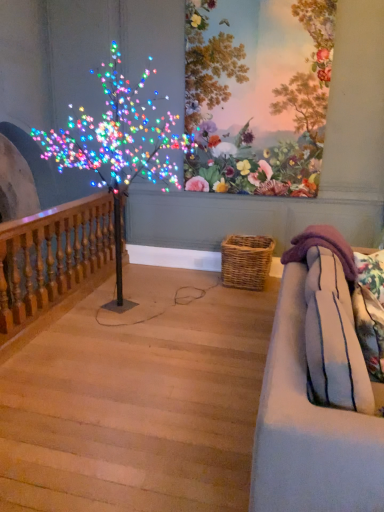
Question: Looking at their shapes, would you say floral wallpaper at upper center is wider or thinner than wooden baluster at left?

Choices:
 (A) thin
 (B) wide

Answer: (A)

Question: In terms of size, does floral wallpaper at upper center appear bigger or smaller than wooden baluster at left?

Choices:
 (A) big
 (B) small

Answer: (B)

Question: Which object is the closest to the wooden baluster at left?

Choices:
 (A) light blue fabric couch at right
 (B) floral wallpaper at upper center
 (C) woven brown basket at lower center
 (D) light wood stairwell at lower left

Answer: (D)

Question: Estimate the real-world distances between objects in this image. Which object is farther from the floral wallpaper at upper center?

Choices:
 (A) light wood stairwell at lower left
 (B) wooden baluster at left
 (C) woven brown basket at lower center
 (D) light blue fabric couch at right

Answer: (D)